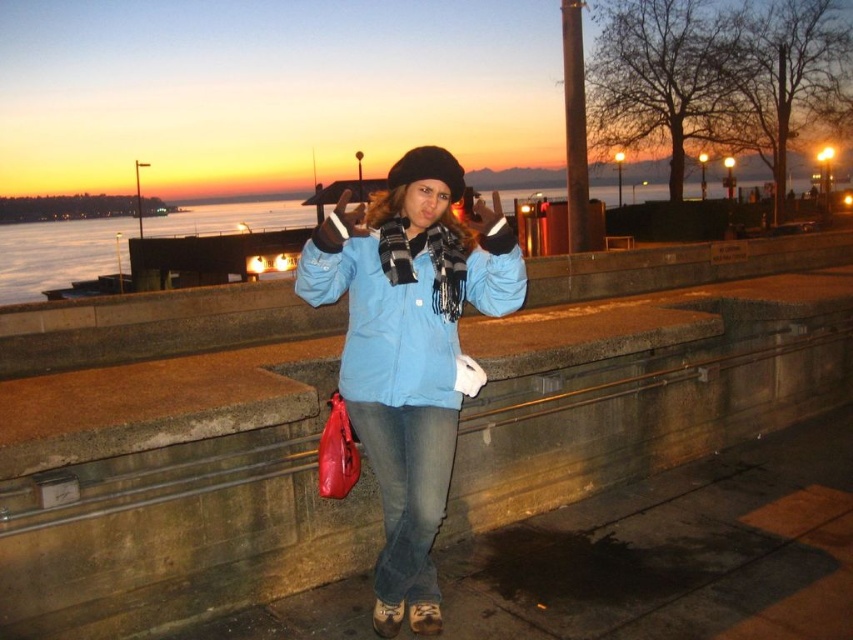
You are planning to place a 1.2 meter wide decorative stone slab on the concrete at center. Given the blue matte jacket at center is currently occupying the area, can the slab fit without moving the jacket?

The concrete at center is narrower than the blue matte jacket at center, so placing a 1.2 meter wide slab might not be possible without moving the jacket as the concrete itself is narrower than the jacket.

You are standing on the waterfront promenade and want to take a photo of the sunset. The blue matte jacket at center is in your way. Can you step back to get the jacket out of the frame without moving it?

The blue matte jacket at center is 2.20 meters away from the viewer. By stepping back, you can increase this distance, which may help in framing the sunset without the jacket obstructing the view.

You are a photographer trying to capture the blue matte jacket at center and the concrete at center in the same frame. Based on their positions, which object should you focus on first to ensure both are in focus?

The blue matte jacket at center is behind the concrete at center, so you should focus on the concrete at center first to ensure both are in focus.